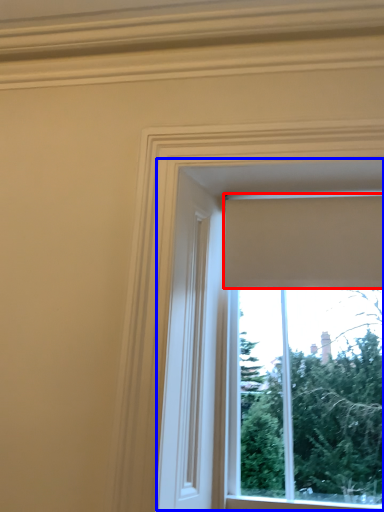
Question: Which object appears closest to the camera in this image, curtain (highlighted by a red box) or window (highlighted by a blue box)?

Choices:
 (A) curtain
 (B) window

Answer: (B)